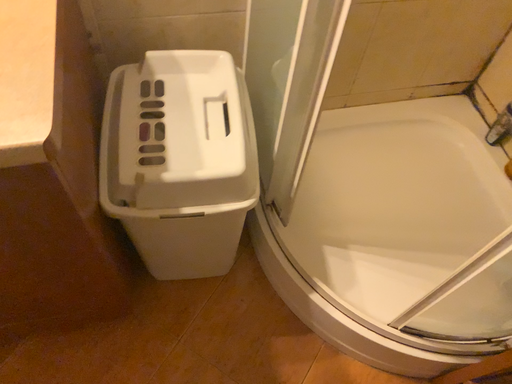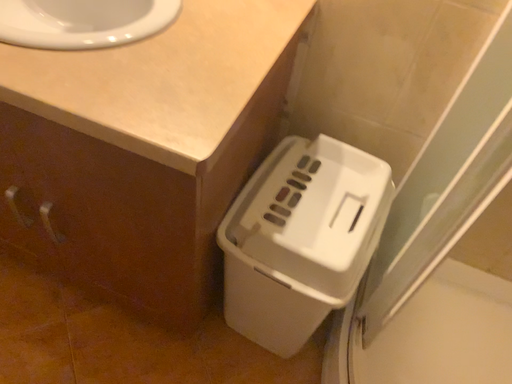
Question: Which way did the camera rotate in the video?

Choices:
 (A) rotated right
 (B) rotated left

Answer: (B)